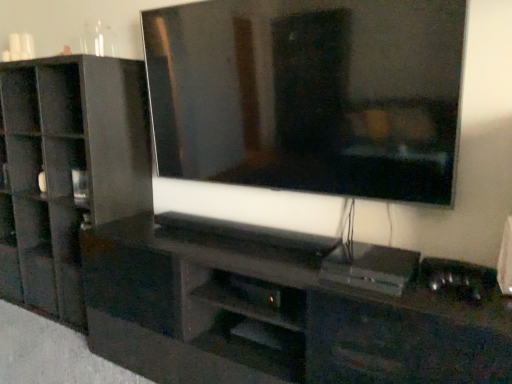
I want to click on black glossy shelf at left, so pos(67,171).

In order to face black glossy shelf at left, should I rotate leftwards or rightwards?

A 24.838 degree turn to the left will do.

Image resolution: width=512 pixels, height=384 pixels. Describe the element at coordinates (67, 171) in the screenshot. I see `black glossy shelf at left` at that location.

Where is `black glossy shelf at left`? This screenshot has height=384, width=512. black glossy shelf at left is located at coordinates (67, 171).